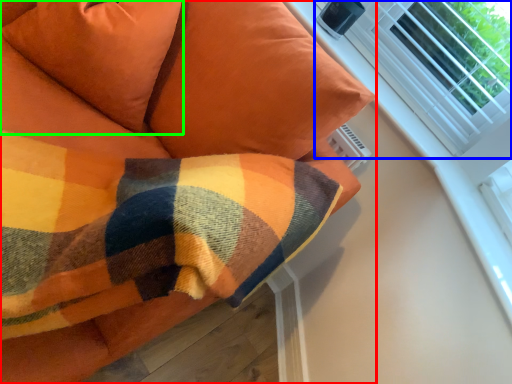
Question: Based on their relative distances, which object is nearer to furniture (highlighted by a red box)? Choose from bay window (highlighted by a blue box) and pillow (highlighted by a green box).

Choices:
 (A) bay window
 (B) pillow

Answer: (B)